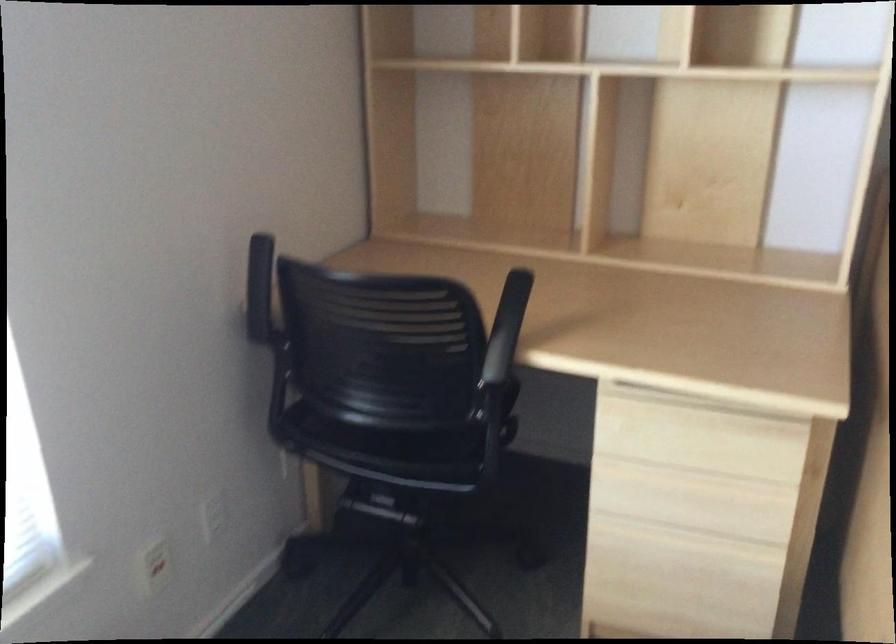
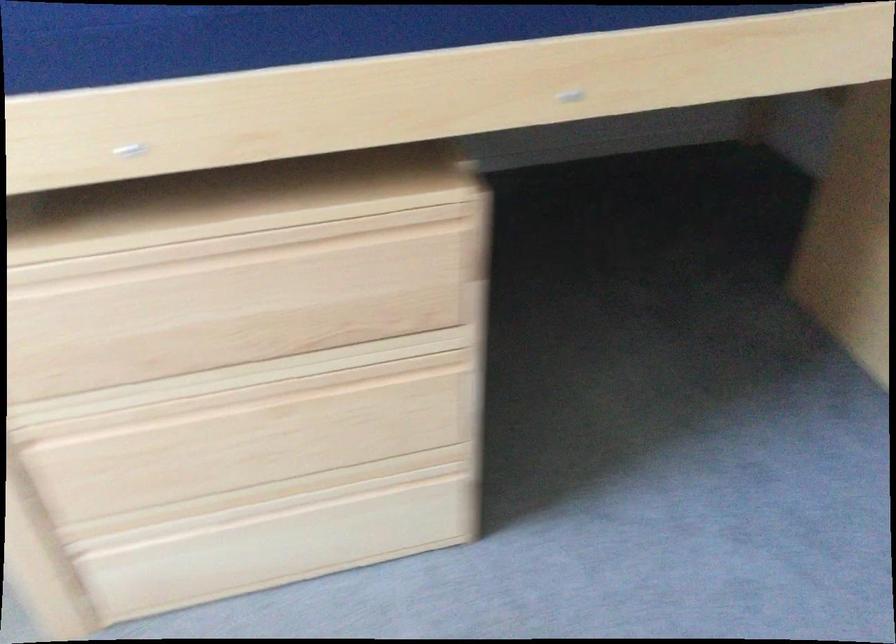
The first image is from the beginning of the video and the second image is from the end. How did the camera likely rotate when shooting the video?

The camera's rotation is toward right-down.